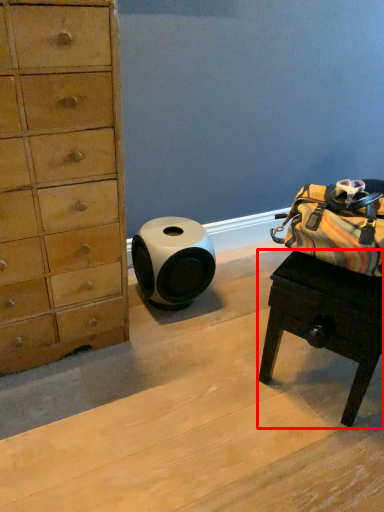
Question: In this image, where is desk (annotated by the red box) located relative to speaker?

Choices:
 (A) right
 (B) left

Answer: (A)